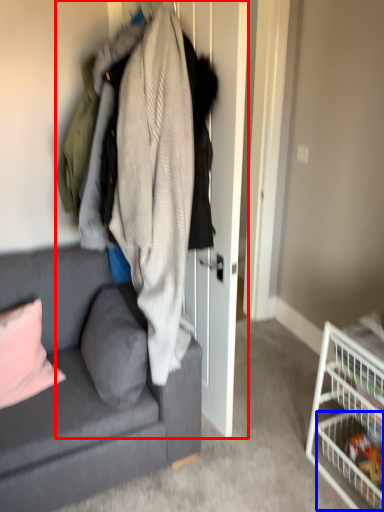
Question: Which object appears closest to the camera in this image, closet (highlighted by a red box) or shelf (highlighted by a blue box)?

Choices:
 (A) closet
 (B) shelf

Answer: (A)